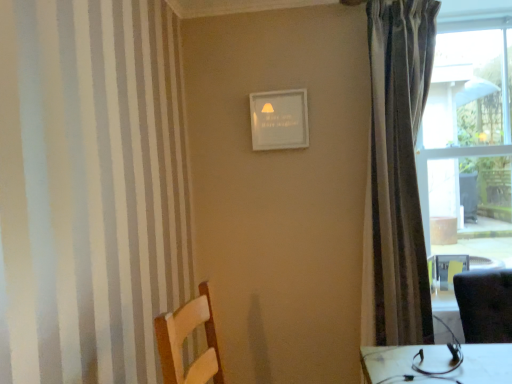
Question: Is point (385, 251) positioned closer to the camera than point (506, 152)?

Choices:
 (A) closer
 (B) farther

Answer: (A)

Question: From a real-world perspective, relative to transparent glass window at right, is silky gray curtain at right vertically above or below?

Choices:
 (A) above
 (B) below

Answer: (B)

Question: From their relative heights in the image, would you say silky gray curtain at right is taller or shorter than transparent glass window at right?

Choices:
 (A) short
 (B) tall

Answer: (B)

Question: Is transparent glass window at right inside the boundaries of silky gray curtain at right, or outside?

Choices:
 (A) outside
 (B) inside

Answer: (A)

Question: Is transparent glass window at right taller or shorter than silky gray curtain at right?

Choices:
 (A) short
 (B) tall

Answer: (A)

Question: In terms of width, does transparent glass window at right look wider or thinner when compared to silky gray curtain at right?

Choices:
 (A) thin
 (B) wide

Answer: (B)

Question: Considering the positions of point (462, 241) and point (375, 286), is point (462, 241) closer or farther from the camera than point (375, 286)?

Choices:
 (A) closer
 (B) farther

Answer: (B)